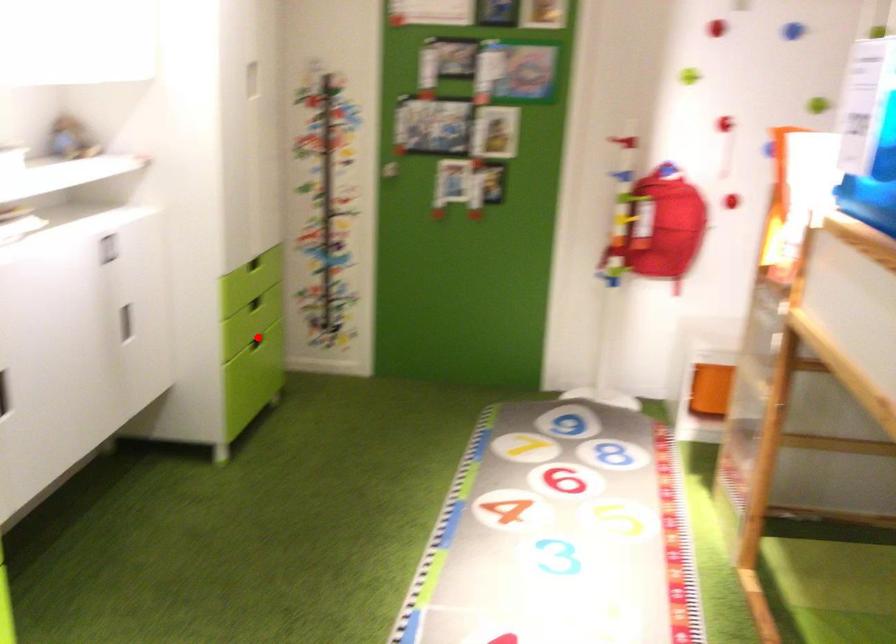
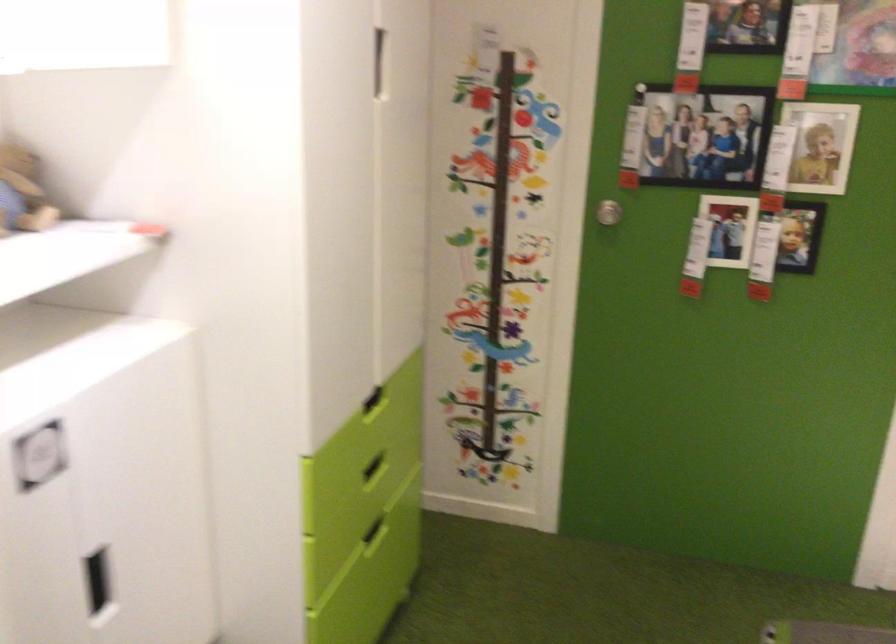
Locate, in the second image, the point that corresponds to the highlighted location in the first image.

(375, 531)